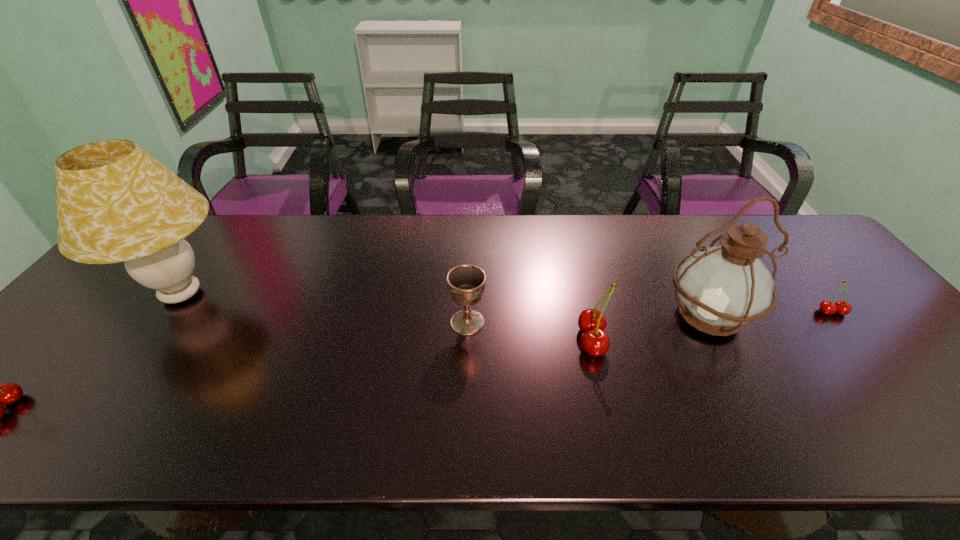
The height and width of the screenshot is (540, 960). Find the location of `free spot that satisfies the following two spatial constraints: 1. on the back side of the chalice; 2. on the right side of the oil lamp`. free spot that satisfies the following two spatial constraints: 1. on the back side of the chalice; 2. on the right side of the oil lamp is located at coordinates (468, 316).